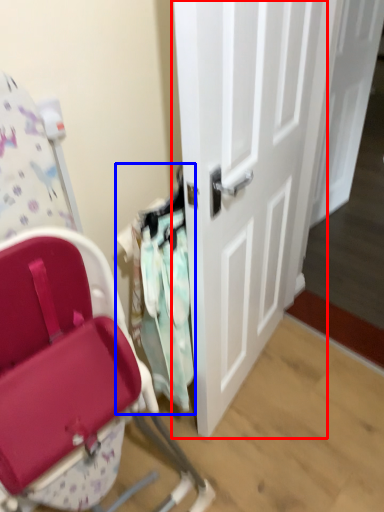
Question: Among these objects, which one is farthest to the camera, door (highlighted by a red box) or laundry (highlighted by a blue box)?

Choices:
 (A) door
 (B) laundry

Answer: (B)